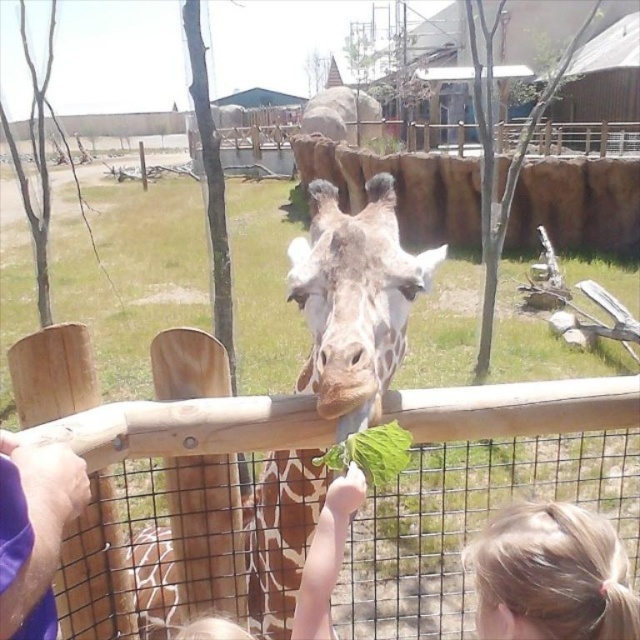
Question: Which point is closer to the camera?

Choices:
 (A) (38, 509)
 (B) (516, 524)
 (C) (376, 262)
 (D) (134, 520)

Answer: (A)

Question: Can you confirm if spotted brown giraffe at center is positioned to the left of purple fabric hand at lower left?

Choices:
 (A) no
 (B) yes

Answer: (A)

Question: Does spotted brown giraffe at center appear on the right side of purple fabric hand at lower left?

Choices:
 (A) yes
 (B) no

Answer: (A)

Question: Is blonde hair at upper right to the right of purple fabric hand at lower left from the viewer's perspective?

Choices:
 (A) yes
 (B) no

Answer: (A)

Question: Which point is closer to the camera?

Choices:
 (A) blonde hair at upper right
 (B) spotted brown giraffe at center
 (C) purple fabric hand at lower left
 (D) wooden fence at center

Answer: (C)

Question: Which point is farther from the camera taking this photo?

Choices:
 (A) (317, 412)
 (B) (86, 484)
 (C) (291, 536)

Answer: (C)